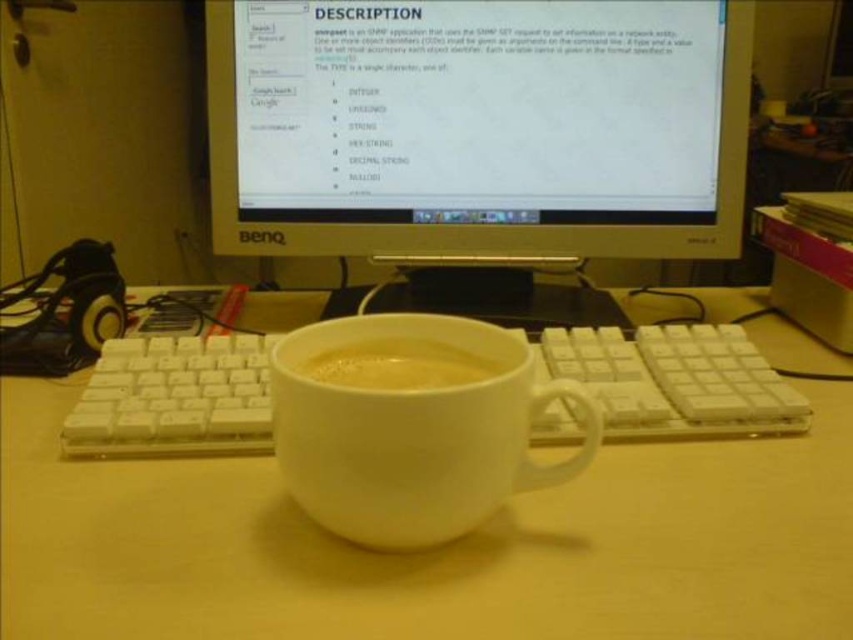
Question: Is white glossy computer monitor at upper center smaller than white matte cup at center?

Choices:
 (A) no
 (B) yes

Answer: (A)

Question: Which point appears closest to the camera in this image?

Choices:
 (A) (444, 364)
 (B) (641, 116)

Answer: (A)

Question: Among these objects, which one is farthest from the camera?

Choices:
 (A) white plastic keyboard at center
 (B) white matte mug at center
 (C) white matte cup at center

Answer: (C)

Question: In this image, where is white plastic keyboard at center located relative to white matte cup at center?

Choices:
 (A) below
 (B) above

Answer: (A)

Question: Which point is closer to the camera?

Choices:
 (A) white matte cup at center
 (B) white glossy computer monitor at upper center

Answer: (A)

Question: Is white plastic keyboard at center closer to the viewer compared to white matte cup at center?

Choices:
 (A) yes
 (B) no

Answer: (A)